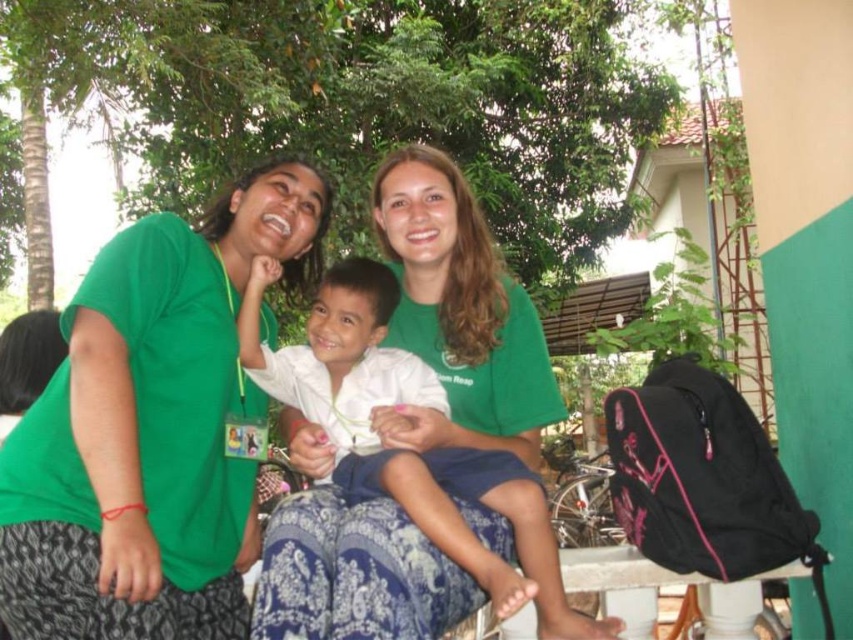
Can you confirm if green fabric shirt at center is positioned to the left of green cotton shirt at center?

Yes, green fabric shirt at center is to the left of green cotton shirt at center.

Between point (415, 419) and point (399, 321), which one is positioned in front?

Positioned in front is point (415, 419).

Between point (51, 388) and point (474, 243), which one is positioned in front?

Point (51, 388) is more forward.

At what (x,y) coordinates should I click in order to perform the action: click on green fabric shirt at center. Please return your answer as a coordinate pair (x, y). Looking at the image, I should click on (148, 428).

Between green cotton shirt at center and white cotton shirt at center, which one is positioned lower?

white cotton shirt at center

In the scene shown: Between green cotton shirt at center and white cotton shirt at center, which one appears on the left side from the viewer's perspective?

From the viewer's perspective, white cotton shirt at center appears more on the left side.

Locate an element on the screen. green cotton shirt at center is located at coordinates (460, 312).

Who is taller, green fabric shirt at center or white cotton shirt at center?

green fabric shirt at center is taller.

Is point (44, 515) positioned after point (254, 333)?

No, (44, 515) is closer to viewer.

I want to click on green fabric shirt at center, so click(x=148, y=428).